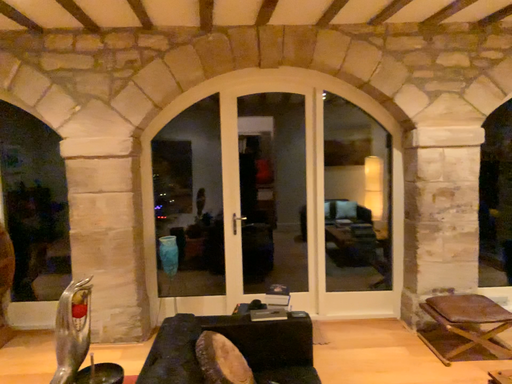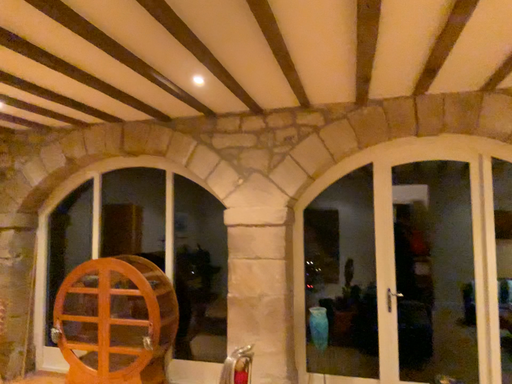
Question: Which way did the camera rotate in the video?

Choices:
 (A) rotated left
 (B) rotated right

Answer: (A)